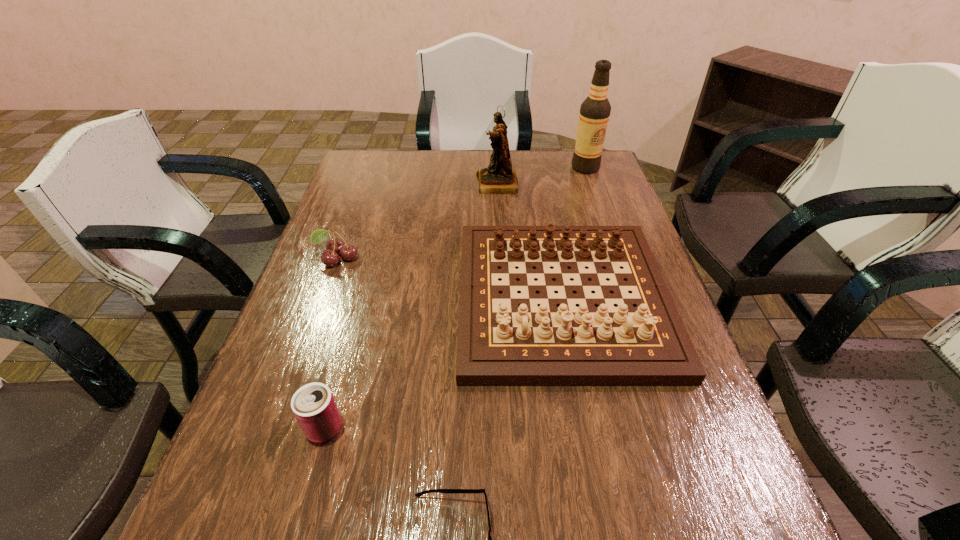
You are a GUI agent. You are given a task and a screenshot of the screen. Output one action in this format:
    pyautogui.click(x=<x>, y=<y>)
    Task: Click on the tallest object
    
    Given the screenshot: What is the action you would take?
    click(594, 114)

Locate an element on the screen. the fifth shortest object is located at coordinates (498, 178).

The width and height of the screenshot is (960, 540). Identify the location of gameboard. (500, 343).

Where is `the fifth farthest object`? the fifth farthest object is located at coordinates (313, 405).

At what (x,y) coordinates should I click in order to perform the action: click on cherry. Please return your answer as a coordinate pair (x, y). Looking at the image, I should click on (335, 246).

This screenshot has height=540, width=960. I want to click on vacant position located 0.350m on the label of the alcohol, so click(x=610, y=238).

Identify the location of free space located on the front-facing side of the second tallest object. (365, 184).

This screenshot has height=540, width=960. Find the location of `vacant area situated 0.050m on the front-facing side of the second tallest object`. vacant area situated 0.050m on the front-facing side of the second tallest object is located at coordinates (461, 184).

I want to click on free point located on the front-facing side of the second tallest object, so click(452, 184).

Locate an element on the screen. Image resolution: width=960 pixels, height=540 pixels. free space located on the side with the white pieces of the gameboard is located at coordinates (601, 505).